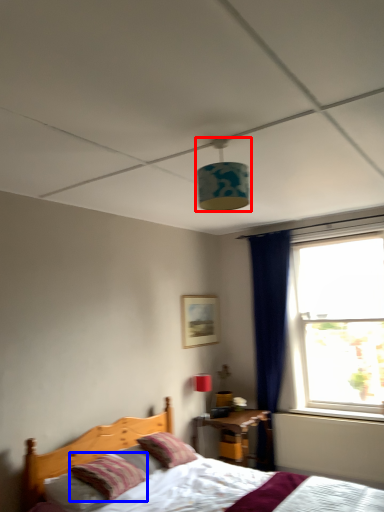
Question: Which of the following is the farthest to the observer, lamp (highlighted by a red box) or pillow (highlighted by a blue box)?

Choices:
 (A) lamp
 (B) pillow

Answer: (B)